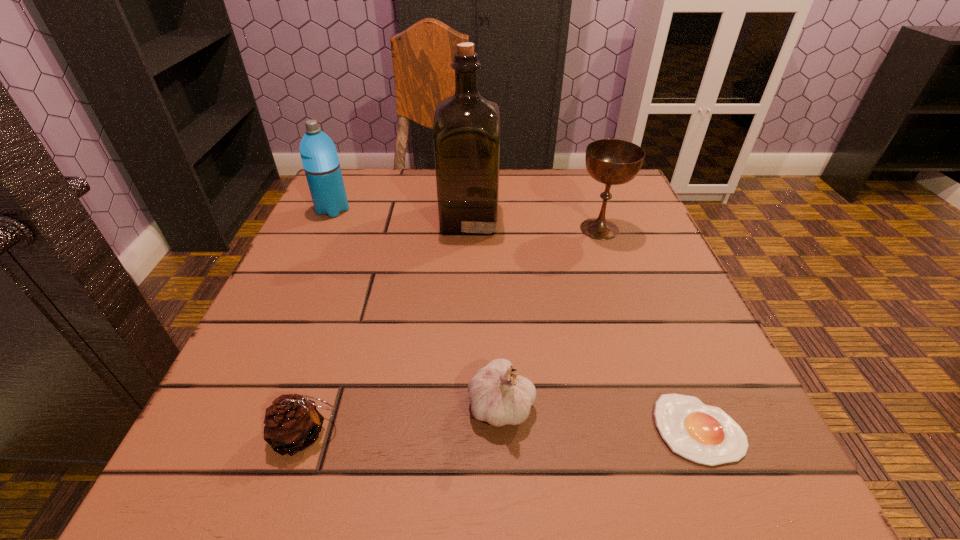
Identify the location of the tallest object. The height and width of the screenshot is (540, 960). (466, 132).

The image size is (960, 540). I want to click on the leftmost object, so click(319, 157).

This screenshot has width=960, height=540. What are the coordinates of `chalice` in the screenshot? It's located at (609, 161).

The height and width of the screenshot is (540, 960). In order to click on the fourth tallest object in this screenshot , I will do `click(497, 396)`.

Where is `the second object from left to right`? The width and height of the screenshot is (960, 540). the second object from left to right is located at coordinates (292, 423).

The height and width of the screenshot is (540, 960). In order to click on the second shortest object in this screenshot , I will do `click(292, 423)`.

You are a GUI agent. You are given a task and a screenshot of the screen. Output one action in this format:
    pyautogui.click(x=<x>, y=<y>)
    Task: Click on the egg yolk
    This screenshot has height=540, width=960.
    Given the screenshot: What is the action you would take?
    tap(705, 434)

You are a GUI agent. You are given a task and a screenshot of the screen. Output one action in this format:
    pyautogui.click(x=<x>, y=<y>)
    Task: Click on the vacant space located 0.340m on the label of the liquor
    Image resolution: width=960 pixels, height=540 pixels.
    Given the screenshot: What is the action you would take?
    pyautogui.click(x=651, y=218)

Locate an element on the screen. blank area located on the front of the leftmost object is located at coordinates [263, 360].

The image size is (960, 540). Identify the location of vacant space located 0.090m on the left of the chalice. (532, 229).